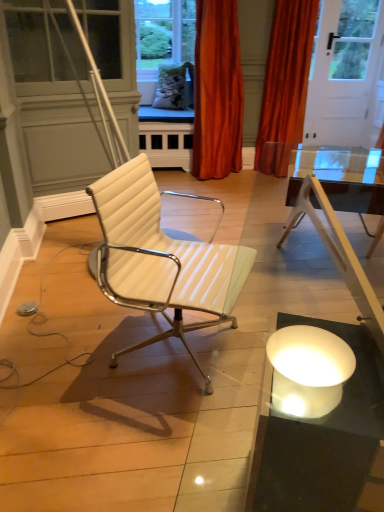
Locate an element on the screen. Image resolution: width=384 pixels, height=512 pixels. free location in front of orange velvet curtain at upper center, which is the second curtain from right to left is located at coordinates (224, 191).